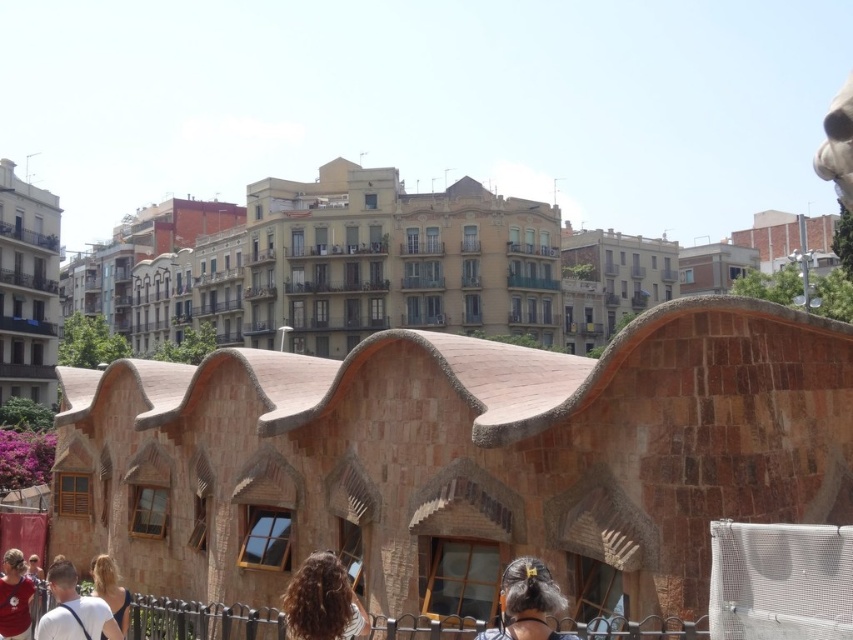
Question: Can you confirm if curly hair at center is positioned to the left of matte red shirt at lower left?

Choices:
 (A) yes
 (B) no

Answer: (B)

Question: Which of the following is the closest to the observer?

Choices:
 (A) (532, 636)
 (B) (114, 598)
 (C) (453, 618)
 (D) (846, 163)

Answer: (A)

Question: Which point is closer to the camera?

Choices:
 (A) black wrought iron fence at lower center
 (B) dark brown hair at center

Answer: (B)

Question: Does curly hair at center appear on the right side of blonde hair at lower left?

Choices:
 (A) yes
 (B) no

Answer: (A)

Question: Can you confirm if curly hair at center is wider than light brown hair at lower center?

Choices:
 (A) yes
 (B) no

Answer: (B)

Question: Considering the real-world distances, which object is farthest from the matte red shirt at lower left?

Choices:
 (A) blonde hair at lower left
 (B) white fur at upper right
 (C) curly hair at center

Answer: (B)